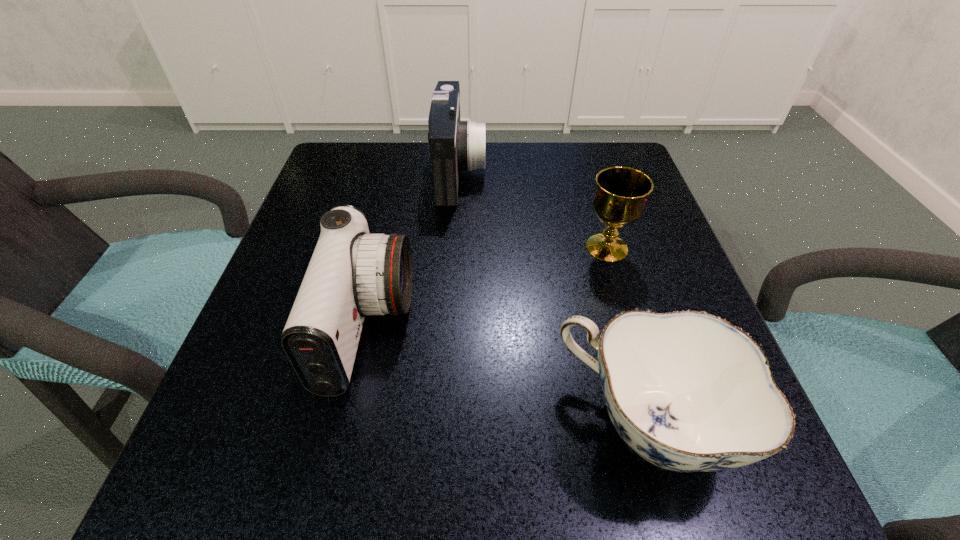
Where is `vacant region at the far left corner`? vacant region at the far left corner is located at coordinates (377, 188).

Find the location of `free spot at the far right corner of the desktop`. free spot at the far right corner of the desktop is located at coordinates (603, 157).

You are a GUI agent. You are given a task and a screenshot of the screen. Output one action in this format:
    pyautogui.click(x=<x>, y=<y>)
    Task: Click on the vacant space that's between the chinaware and the left camcorder
    Image resolution: width=960 pixels, height=540 pixels.
    Given the screenshot: What is the action you would take?
    pyautogui.click(x=507, y=376)

This screenshot has width=960, height=540. What are the coordinates of `free space between the third object from right to left and the chalice` in the screenshot? It's located at (533, 210).

Find the location of `blank region between the right camcorder and the chalice`. blank region between the right camcorder and the chalice is located at coordinates (533, 210).

In order to click on free space between the second object from left to right and the third nearest object in this screenshot , I will do `click(533, 210)`.

Image resolution: width=960 pixels, height=540 pixels. In order to click on vacant area between the third object from right to left and the nearer camcorder in this screenshot , I will do `click(414, 250)`.

Find the location of a particular element. This screenshot has width=960, height=540. free space between the chinaware and the leftmost object is located at coordinates (507, 376).

At what (x,y) coordinates should I click in order to perform the action: click on vacant space that is in between the nearer camcorder and the third object from right to left. Please return your answer as a coordinate pair (x, y). Image resolution: width=960 pixels, height=540 pixels. Looking at the image, I should click on (414, 250).

Identify the location of free area in between the second object from left to right and the nearer camcorder. (414, 250).